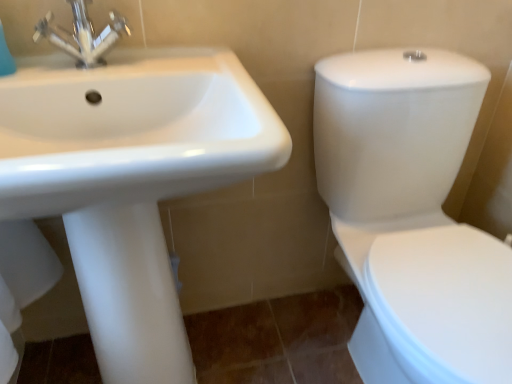
What do you see at coordinates (411, 216) in the screenshot? I see `white glossy toilet at right` at bounding box center [411, 216].

Locate an element on the screen. white glossy toilet at right is located at coordinates (411, 216).

Is white glossy toilet at right beside metallic chrome faucet at upper left?

There is a gap between white glossy toilet at right and metallic chrome faucet at upper left.

Could you tell me if white glossy toilet at right is facing metallic chrome faucet at upper left?

No, white glossy toilet at right is not oriented towards metallic chrome faucet at upper left.

Which object is wider, white glossy toilet at right or metallic chrome faucet at upper left?

With larger width is white glossy toilet at right.

Image resolution: width=512 pixels, height=384 pixels. I want to click on toilet below the metallic chrome faucet at upper left (from a real-world perspective), so click(411, 216).

Relative to white glossy sink at upper left, is white glossy toilet at right in front or behind?

Clearly, white glossy toilet at right is in front of white glossy sink at upper left.

From the image's perspective, is white glossy toilet at right under white glossy sink at upper left?

No, from the image's perspective, white glossy toilet at right is not beneath white glossy sink at upper left.

Is white glossy toilet at right next to white glossy sink at upper left?

They are not placed beside each other.

In the scene shown: Can metallic chrome faucet at upper left be found inside white glossy sink at upper left?

Actually, metallic chrome faucet at upper left is outside white glossy sink at upper left.

Considering their positions, is white glossy sink at upper left located in front of or behind metallic chrome faucet at upper left?

Clearly, white glossy sink at upper left is in front of metallic chrome faucet at upper left.

Which object is positioned more to the right, white glossy sink at upper left or metallic chrome faucet at upper left?

white glossy sink at upper left is more to the right.

Is white glossy sink at upper left touching metallic chrome faucet at upper left?

No, white glossy sink at upper left is not with metallic chrome faucet at upper left.

Considering the relative sizes of white glossy sink at upper left and white glossy toilet at right in the image provided, is white glossy sink at upper left bigger than white glossy toilet at right?

No, white glossy sink at upper left is not bigger than white glossy toilet at right.

You are a GUI agent. You are given a task and a screenshot of the screen. Output one action in this format:
    pyautogui.click(x=<x>, y=<y>)
    Task: Click on the sink behind the white glossy toilet at right
    The width and height of the screenshot is (512, 384).
    Given the screenshot: What is the action you would take?
    pyautogui.click(x=130, y=179)

From the image's perspective, is white glossy sink at upper left under white glossy toilet at right?

Yes, from the image's perspective, white glossy sink at upper left is beneath white glossy toilet at right.

Based on the photo, relative to white glossy toilet at right, is white glossy sink at upper left in front or behind?

Clearly, white glossy sink at upper left is behind white glossy toilet at right.

From a real-world perspective, which is physically below, metallic chrome faucet at upper left or white glossy sink at upper left?

white glossy sink at upper left, from a real-world perspective.

How different are the orientations of metallic chrome faucet at upper left and white glossy sink at upper left in degrees?

The angle between the facing direction of metallic chrome faucet at upper left and the facing direction of white glossy sink at upper left is 0.000264 degrees.

From the image's perspective, which object appears higher, metallic chrome faucet at upper left or white glossy sink at upper left?

metallic chrome faucet at upper left appears higher in the image.

At what (x,y) coordinates should I click in order to perform the action: click on sink that appears below the metallic chrome faucet at upper left (from a real-world perspective). Please return your answer as a coordinate pair (x, y). The height and width of the screenshot is (384, 512). Looking at the image, I should click on (130, 179).

Can you tell me how much metallic chrome faucet at upper left and white glossy toilet at right differ in facing direction?

metallic chrome faucet at upper left and white glossy toilet at right are facing 1.53 degrees away from each other.

Between metallic chrome faucet at upper left and white glossy toilet at right, which one has smaller size?

metallic chrome faucet at upper left.

Does point (77, 60) appear closer or farther from the camera than point (389, 287)?

Point (77, 60) is closer to the camera than point (389, 287).

Which is correct: metallic chrome faucet at upper left is inside white glossy toilet at right, or outside of it?

The correct answer is: outside.

This screenshot has width=512, height=384. What are the coordinates of `tap above the white glossy toilet at right (from a real-world perspective)` in the screenshot? It's located at (84, 35).

Identify the location of sink located on the left of white glossy toilet at right. (130, 179).

Based on their spatial positions, is white glossy toilet at right or metallic chrome faucet at upper left closer to white glossy sink at upper left?

metallic chrome faucet at upper left lies closer to white glossy sink at upper left than the other object.

From the image, which object appears to be farther from white glossy toilet at right, metallic chrome faucet at upper left or white glossy sink at upper left?

Based on the image, metallic chrome faucet at upper left appears to be further to white glossy toilet at right.

From the picture: Considering their positions, is white glossy sink at upper left positioned further to white glossy toilet at right than metallic chrome faucet at upper left?

Based on the image, metallic chrome faucet at upper left appears to be further to white glossy toilet at right.

From the image, which object appears to be farther from white glossy sink at upper left, metallic chrome faucet at upper left or white glossy toilet at right?

Based on the image, white glossy toilet at right appears to be further to white glossy sink at upper left.

Based on their spatial positions, is white glossy toilet at right or white glossy sink at upper left closer to metallic chrome faucet at upper left?

white glossy sink at upper left is closer to metallic chrome faucet at upper left.

Based on the photo, from the image, which object appears to be farther from metallic chrome faucet at upper left, white glossy sink at upper left or white glossy toilet at right?

white glossy toilet at right.

Find the location of a particular element. The height and width of the screenshot is (384, 512). sink between metallic chrome faucet at upper left and white glossy toilet at right is located at coordinates pyautogui.click(x=130, y=179).